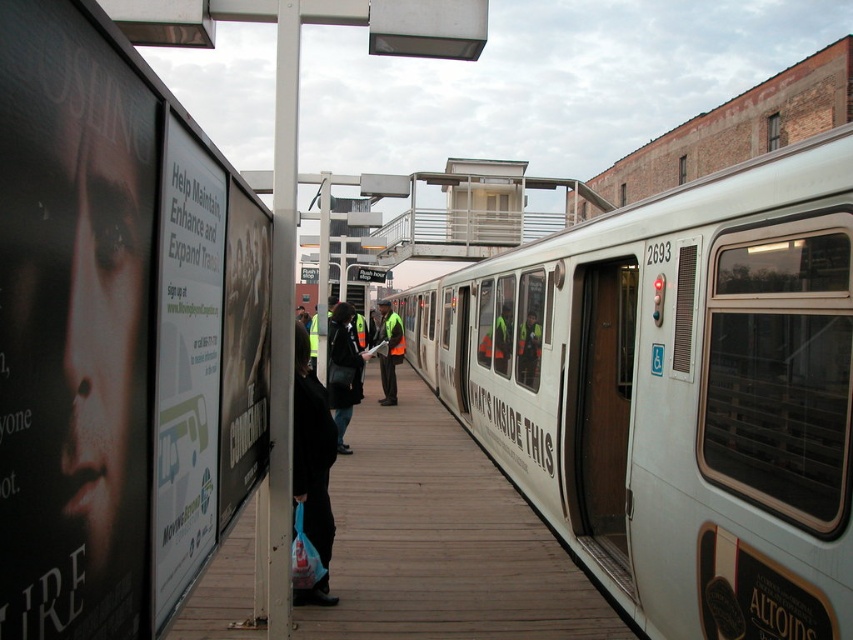
You are standing at the point marked as point (x=677, y=392) on the platform. What object is directly in front of you?

The white metallic train at center is directly in front of you at point (x=677, y=392).